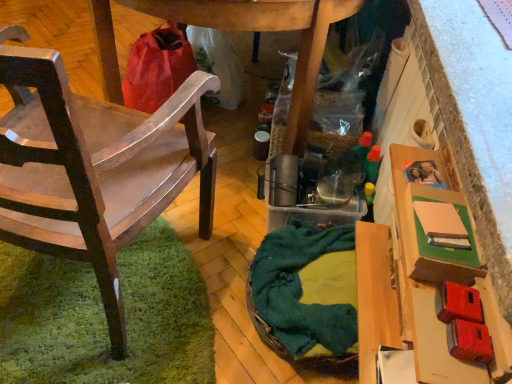
Find the location of a particular element. Image resolution: width=512 pixels, height=384 pixels. green woven basket at center is located at coordinates (289, 352).

Find the location of a particular element. This screenshot has width=512, height=384. green woven basket at center is located at coordinates (289, 352).

Which of these two, matte brown cardboard box at right or wooden chair at left, is wider?

With larger width is wooden chair at left.

I want to click on cardboard box that is under the wooden chair at left (from a real-world perspective), so click(428, 283).

From a real-world perspective, is matte brown cardboard box at right physically located above or below wooden chair at left?

From a real-world perspective, matte brown cardboard box at right is physically below wooden chair at left.

Is wooden chair at left with green woven basket at center?

No.

Is wooden chair at left wider than green woven basket at center?

Indeed, wooden chair at left has a greater width compared to green woven basket at center.

Considering the sizes of objects wooden chair at left and green woven basket at center in the image provided, who is taller, wooden chair at left or green woven basket at center?

With more height is wooden chair at left.

Does wooden chair at left have a larger size compared to green woven basket at center?

Correct, wooden chair at left is larger in size than green woven basket at center.

From a real-world perspective, who is located lower, green woven basket at center or wooden chair at left?

green woven basket at center.

In the scene shown: Considering their positions, is green woven basket at center located in front of or behind wooden chair at left?

Clearly, green woven basket at center is behind wooden chair at left.

Is green woven basket at center surrounding wooden chair at left?

No, wooden chair at left is not inside green woven basket at center.

Could you tell me if green woven basket at center is facing wooden chair at left?

Yes.

Where is `basket below the matte brown cardboard box at right (from the image's perspective)`? This screenshot has width=512, height=384. basket below the matte brown cardboard box at right (from the image's perspective) is located at coordinates (289, 352).

Is point (429, 247) positioned after point (258, 321)?

No, (429, 247) is in front of (258, 321).

Looking at this image, is matte brown cardboard box at right not near green woven basket at center?

They are positioned close to each other.

Is matte brown cardboard box at right in front of green woven basket at center?

That is True.

Between point (47, 66) and point (489, 376), which one is positioned behind?

The point (489, 376) is farther from the camera.

From the image's perspective, which one is positioned higher, wooden chair at left or matte brown cardboard box at right?

wooden chair at left, from the image's perspective.

Looking at this image, relative to matte brown cardboard box at right, is wooden chair at left in front or behind?

Clearly, wooden chair at left is in front of matte brown cardboard box at right.

In the scene shown: From a real-world perspective, is wooden chair at left on matte brown cardboard box at right?

Indeed, from a real-world perspective, wooden chair at left stands above matte brown cardboard box at right.

Considering the sizes of objects green woven basket at center and matte brown cardboard box at right in the image provided, who is taller, green woven basket at center or matte brown cardboard box at right?

matte brown cardboard box at right.

Would you say green woven basket at center is a long distance from matte brown cardboard box at right?

No, green woven basket at center is not far from matte brown cardboard box at right.

From the image's perspective, relative to matte brown cardboard box at right, is green woven basket at center above or below?

Clearly, from the image's perspective, green woven basket at center is below matte brown cardboard box at right.

Consider the image. Considering the sizes of green woven basket at center and matte brown cardboard box at right in the image, is green woven basket at center bigger or smaller than matte brown cardboard box at right?

Clearly, green woven basket at center is larger in size than matte brown cardboard box at right.

There is a matte brown cardboard box at right. Where is `chair above it (from a real-world perspective)`? Image resolution: width=512 pixels, height=384 pixels. chair above it (from a real-world perspective) is located at coordinates (94, 167).

Find the location of a particular element. basket below the wooden chair at left (from a real-world perspective) is located at coordinates (289, 352).

Based on their spatial positions, is green woven basket at center or matte brown cardboard box at right further from wooden chair at left?

Among the two, matte brown cardboard box at right is located further to wooden chair at left.

Considering their positions, is wooden chair at left positioned closer to green woven basket at center than matte brown cardboard box at right?

matte brown cardboard box at right lies closer to green woven basket at center than the other object.

When comparing their distances from green woven basket at center, does matte brown cardboard box at right or wooden chair at left seem closer?

The object closer to green woven basket at center is matte brown cardboard box at right.

Looking at the image, which one is located further to matte brown cardboard box at right, wooden chair at left or green woven basket at center?

The object further to matte brown cardboard box at right is wooden chair at left.

Considering their positions, is matte brown cardboard box at right positioned closer to wooden chair at left than green woven basket at center?

green woven basket at center is closer to wooden chair at left.

Considering their positions, is green woven basket at center positioned further to matte brown cardboard box at right than wooden chair at left?

Among the two, wooden chair at left is located further to matte brown cardboard box at right.

This screenshot has width=512, height=384. Identify the location of basket between wooden chair at left and matte brown cardboard box at right. (289, 352).